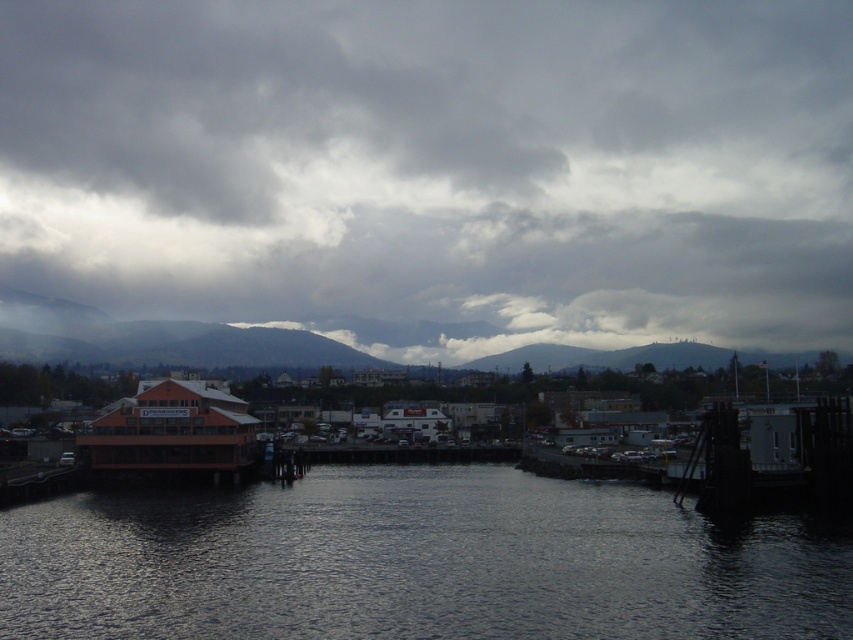
You are an architect designing a new building that needs to consider the sky and water visibility. Based on the scene, which object, cloudy gray sky at upper center or dark reflective water at center, occupies a bigger portion of the view?

The cloudy gray sky at upper center has a larger size compared to the dark reflective water at center, so it occupies a bigger portion of the view.

You are a bird flying at an altitude of 200 meters above the cloudy gray sky at upper center. Can you see the dark reflective water at center from your current position?

The distance between the cloudy gray sky at upper center and the dark reflective water at center is 245.10 meters. Since the bird is flying at 200 meters, it is below the total distance, so yes, the bird can see the dark reflective water at center from its current position.

You are an architect designing a new building and want to ensure it blends with the waterfront scene. Given the cloudy gray sky at upper center and dark reflective water at center, which one has a greater horizontal span in the image?

The cloudy gray sky at upper center has a greater horizontal span than the dark reflective water at center, as its width surpasses that of the water.